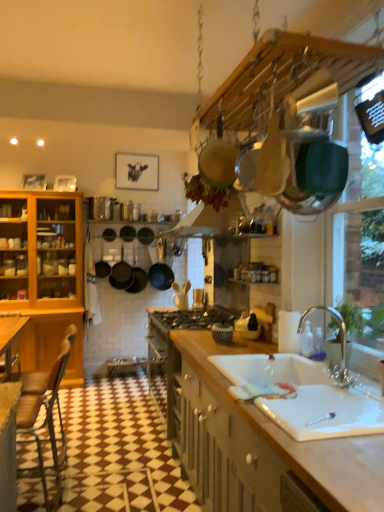
Question: Is point (342, 369) positioned closer to the camera than point (249, 434)?

Choices:
 (A) closer
 (B) farther

Answer: (B)

Question: In the image, is chrome metallic faucet at sink right positioned in front of or behind white wood countertop at lower right?

Choices:
 (A) behind
 (B) front

Answer: (A)

Question: Which is farther from the chrome metallic faucet at sink right?

Choices:
 (A) black matte frying pan at center
 (B) brown leather chair at lower left
 (C) white wood countertop at lower right
 (D) white ceramic sink at lower center

Answer: (A)

Question: Based on their relative distances, which object is nearer to the brown leather chair at lower left?

Choices:
 (A) white ceramic sink at lower center
 (B) white wood countertop at lower right
 (C) chrome metallic faucet at sink right
 (D) black matte frying pan at center

Answer: (B)